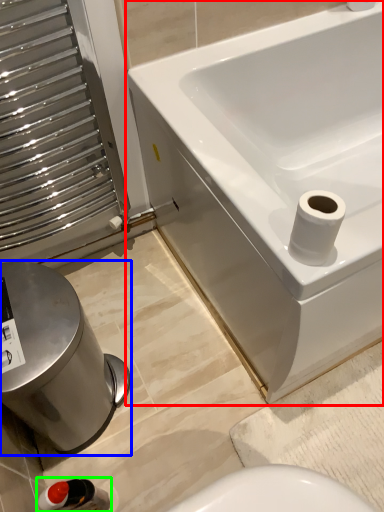
Question: Which object is the farthest from bathtub (highlighted by a red box)? Choose among these: bidet (highlighted by a blue box) or plumbing fixture (highlighted by a green box).

Choices:
 (A) bidet
 (B) plumbing fixture

Answer: (B)